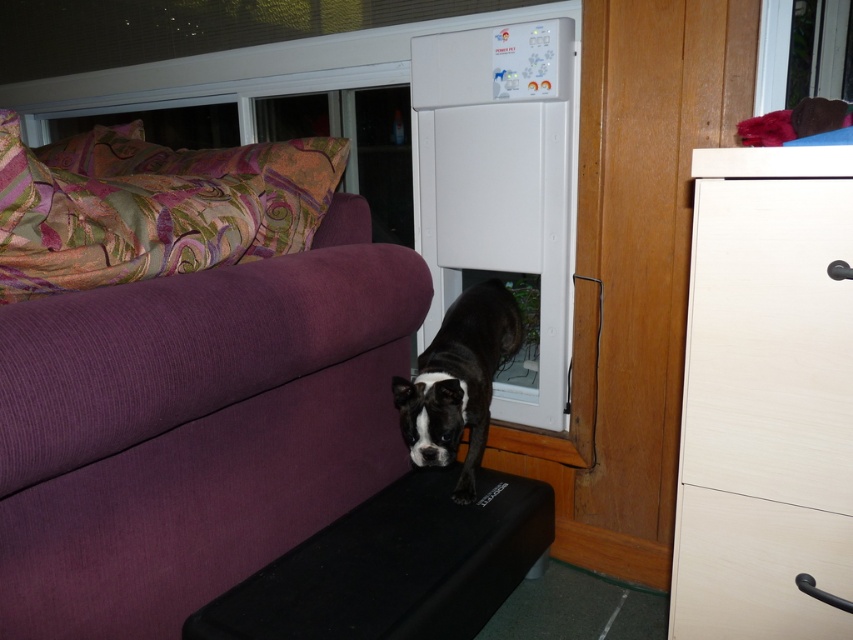
Question: Can you confirm if white wood drawer at lower right is smaller than black matte dog at center?

Choices:
 (A) no
 (B) yes

Answer: (B)

Question: Which object appears farthest from the camera in this image?

Choices:
 (A) white plastic screen door at center
 (B) white wood drawer at lower right

Answer: (A)

Question: Observing the image, what is the correct spatial positioning of white matte drawer at right in reference to black rubber footrest at lower center?

Choices:
 (A) below
 (B) above

Answer: (B)

Question: Which object is positioned closest to the black rubber footrest at lower center?

Choices:
 (A) white wood drawer at lower right
 (B) white plastic screen door at center
 (C) white matte drawer at right

Answer: (A)

Question: Among these objects, which one is farthest from the camera?

Choices:
 (A) purple corduroy couch at lower left
 (B) white matte drawer at right
 (C) black rubber footrest at lower center

Answer: (C)

Question: Does purple corduroy couch at lower left have a greater width compared to black rubber footrest at lower center?

Choices:
 (A) yes
 (B) no

Answer: (B)